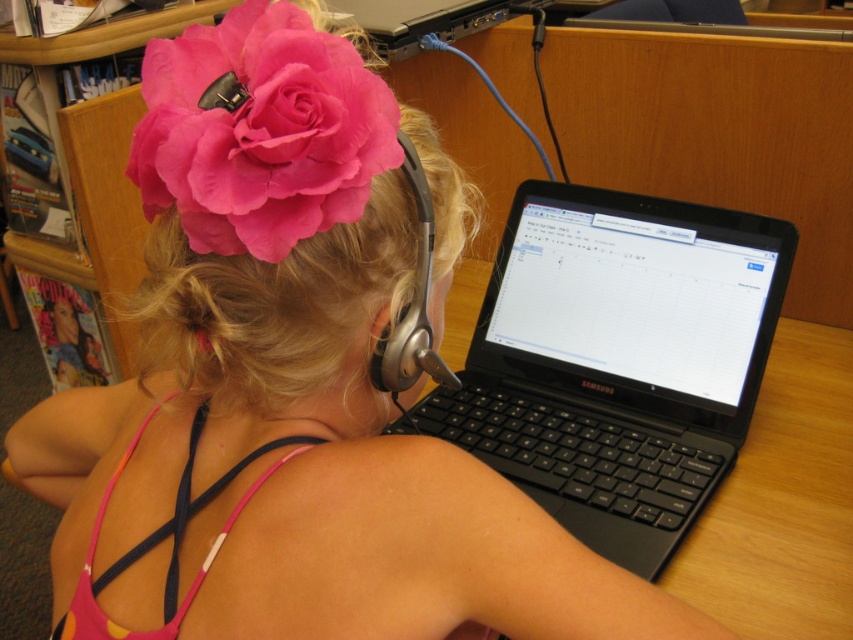
You are a delivery person who needs to place a small package on the desk. The package must be placed exactly where the black plastic laptop at center is located. What coordinates should you aim for?

You should aim for coordinates point (618, 360) where the black plastic laptop at center is located.